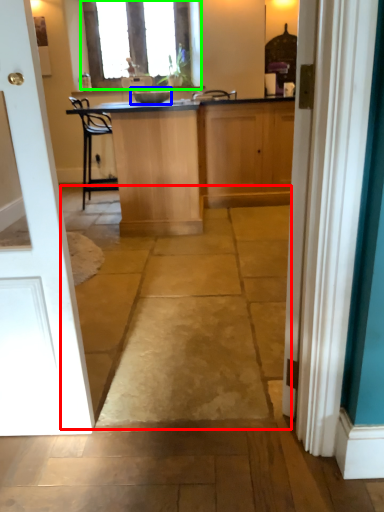
Question: Considering the real-world distances, which object is closest to path (highlighted by a red box)? appliance (highlighted by a blue box) or window (highlighted by a green box).

Choices:
 (A) appliance
 (B) window

Answer: (A)